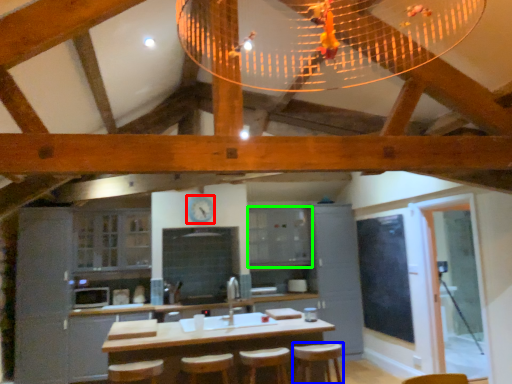
Question: Which object is the farthest from clock (highlighted by a red box)? Choose among these: bar stool (highlighted by a blue box) or cabinetry (highlighted by a green box).

Choices:
 (A) bar stool
 (B) cabinetry

Answer: (A)